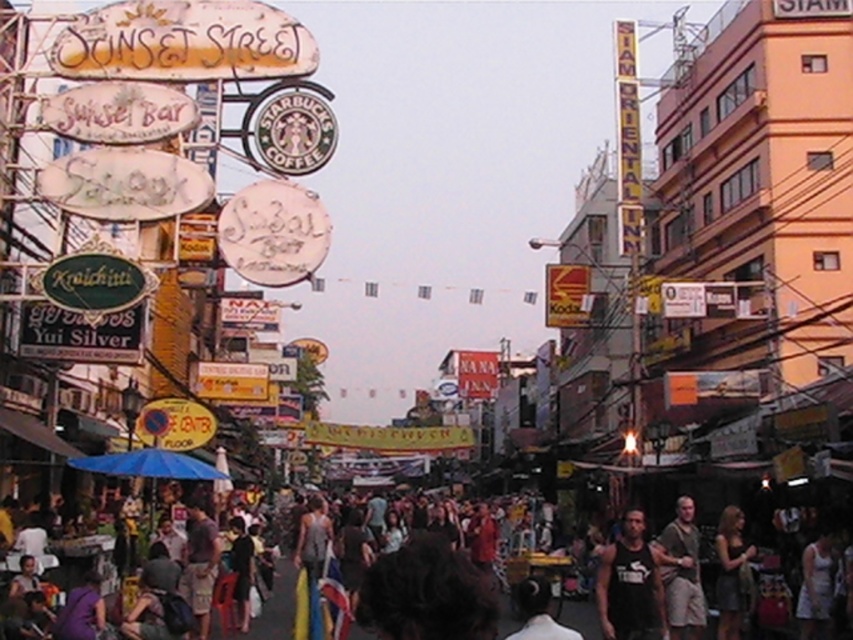
Question: Can you confirm if black tank top at lower right is smaller than dark brown leather jacket at lower right?

Choices:
 (A) yes
 (B) no

Answer: (B)

Question: In this image, where is black tank top at lower right located relative to dark brown leather jacket at lower right?

Choices:
 (A) below
 (B) above

Answer: (B)

Question: Estimate the real-world distances between objects in this image. Which object is closer to the dark brown leather jacket at lower right?

Choices:
 (A) brown textured shirt at lower right
 (B) black tank top at lower right

Answer: (A)

Question: Can you confirm if black tank top at lower right is positioned above brown textured shirt at lower right?

Choices:
 (A) no
 (B) yes

Answer: (A)

Question: Which object appears farthest from the camera in this image?

Choices:
 (A) black tank top at lower right
 (B) brown textured shirt at lower right

Answer: (B)

Question: Among these objects, which one is nearest to the camera?

Choices:
 (A) brown textured shirt at lower right
 (B) dark brown leather jacket at lower right
 (C) black tank top at lower right

Answer: (C)